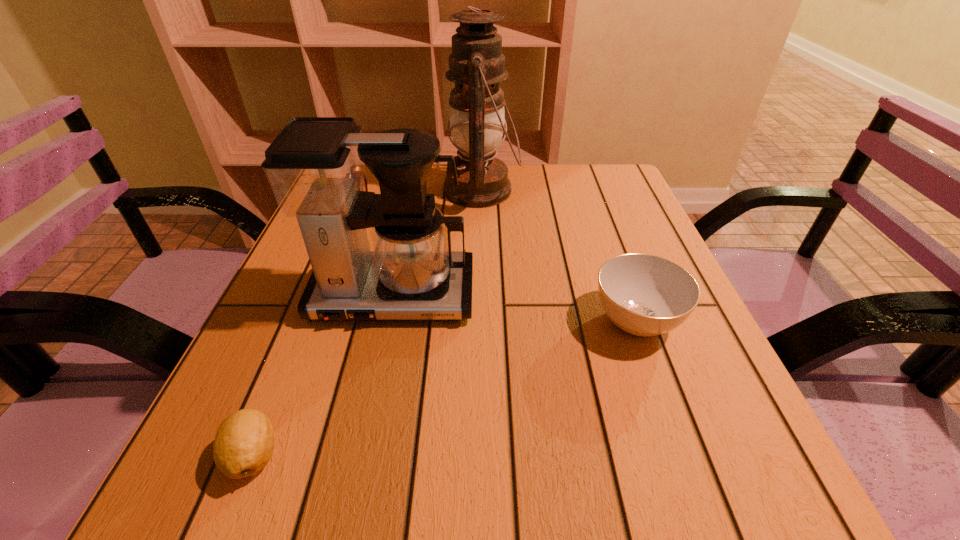
Find the location of a particular element. The width and height of the screenshot is (960, 540). free space between the third tallest object and the nearest object is located at coordinates (305, 330).

This screenshot has width=960, height=540. Identify the location of vacant area that lies between the rightmost object and the third tallest object. (496, 263).

Image resolution: width=960 pixels, height=540 pixels. Find the location of `free space between the third shortest object and the second shortest object`. free space between the third shortest object and the second shortest object is located at coordinates (496, 263).

Locate an element on the screen. The image size is (960, 540). empty space between the second shortest object and the tallest object is located at coordinates (559, 255).

Locate an element on the screen. This screenshot has height=540, width=960. unoccupied position between the nearest object and the alarm clock is located at coordinates (305, 330).

Where is `object that stands as the third closest to the alarm clock`? object that stands as the third closest to the alarm clock is located at coordinates (645, 295).

Locate an element on the screen. Image resolution: width=960 pixels, height=540 pixels. object that stands as the fourth closest to the second tallest object is located at coordinates (645, 295).

Locate an element on the screen. The height and width of the screenshot is (540, 960). free spot that satisfies the following two spatial constraints: 1. on the front-facing side of the alarm clock; 2. at the stem end of the nearest object is located at coordinates (258, 455).

At what (x,y) coordinates should I click in order to perform the action: click on vacant space that satisfies the following two spatial constraints: 1. at the front of the chinaware where the controls are located; 2. on the right side of the fourth shortest object. Please return your answer as a coordinate pair (x, y). Looking at the image, I should click on (388, 321).

Locate an element on the screen. The height and width of the screenshot is (540, 960). free spot that satisfies the following two spatial constraints: 1. on the front-facing side of the third tallest object; 2. at the stem end of the nearest object is located at coordinates (258, 455).